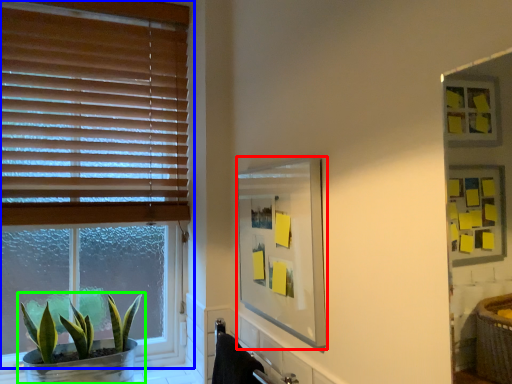
Question: Based on their relative distances, which object is farther from mirror (highlighted by a red box)? Choose from window (highlighted by a blue box) and houseplant (highlighted by a green box).

Choices:
 (A) window
 (B) houseplant

Answer: (B)